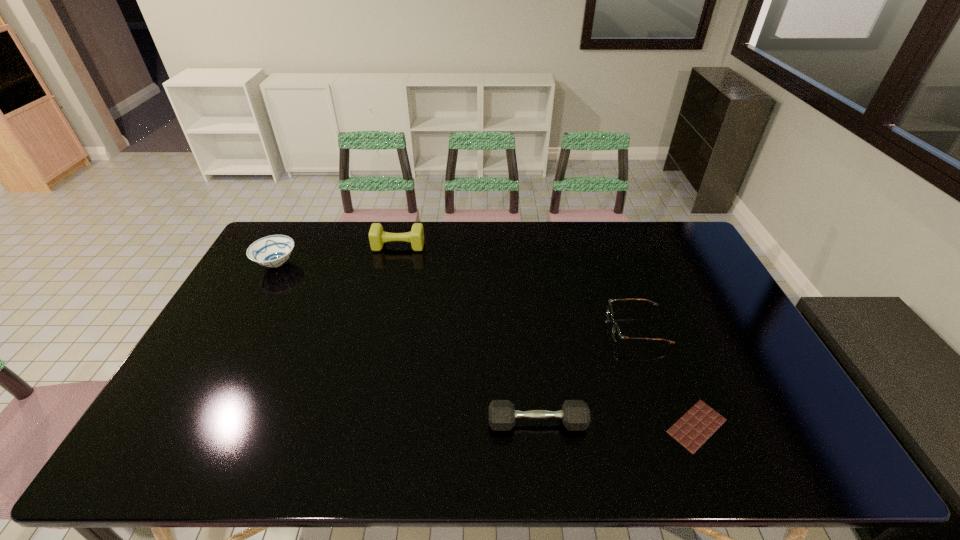
The width and height of the screenshot is (960, 540). I want to click on object present at the far left corner, so click(x=272, y=251).

In the image, there is a desktop. Where is `vacant area at the far edge`? Image resolution: width=960 pixels, height=540 pixels. vacant area at the far edge is located at coordinates (351, 250).

Identify the location of vacant space at the near edge. Image resolution: width=960 pixels, height=540 pixels. (732, 447).

Find the location of a particular element. free space at the left edge of the desktop is located at coordinates (216, 406).

Where is `free space at the right edge of the desktop`? free space at the right edge of the desktop is located at coordinates (732, 309).

At what (x,y) coordinates should I click in order to perform the action: click on vacant space at the far left corner. Please return your answer as a coordinate pair (x, y). Looking at the image, I should click on (294, 228).

Where is `vacant space at the far right corner of the desktop`? The height and width of the screenshot is (540, 960). vacant space at the far right corner of the desktop is located at coordinates (693, 250).

The width and height of the screenshot is (960, 540). I want to click on free point at the near right corner, so click(756, 462).

This screenshot has width=960, height=540. I want to click on free spot between the fourth tallest object and the shortest object, so click(666, 377).

I want to click on free spot between the third object from left to right and the shortest object, so click(x=617, y=424).